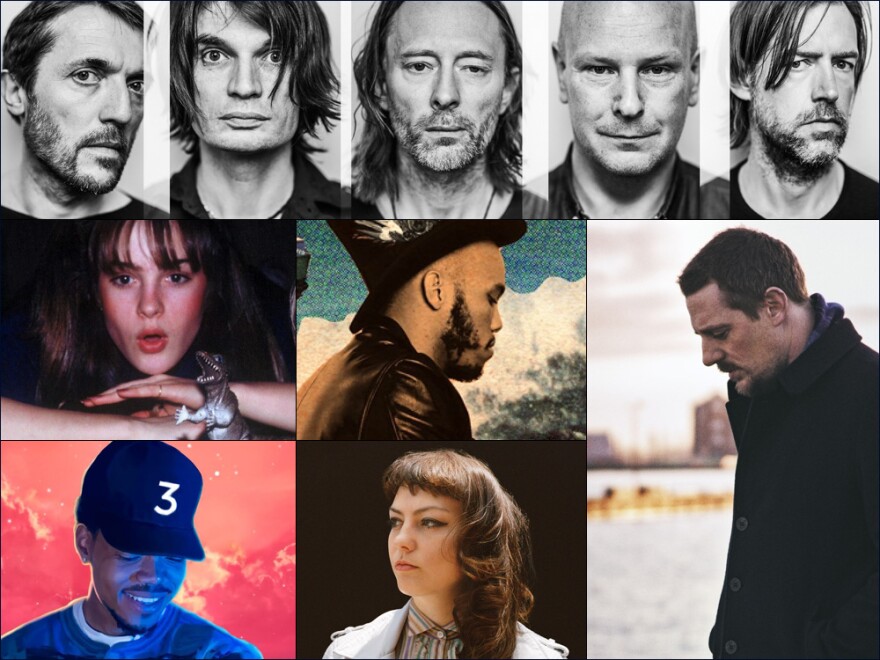
At what (x,y) coordinates should I click in order to perform the action: click on black and white photos. Please return your answer as a coordinate pair (x, y). The image size is (880, 660). Looking at the image, I should click on (100, 82), (238, 96), (464, 106), (595, 98), (752, 98).